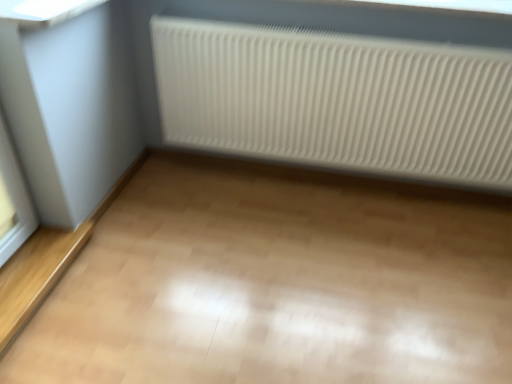
Locate an element on the screen. This screenshot has width=512, height=384. white plastic radiator at upper center is located at coordinates (337, 100).

Image resolution: width=512 pixels, height=384 pixels. What do you see at coordinates (337, 100) in the screenshot?
I see `white plastic radiator at upper center` at bounding box center [337, 100].

This screenshot has width=512, height=384. Find the location of `white plastic radiator at upper center`. white plastic radiator at upper center is located at coordinates (337, 100).